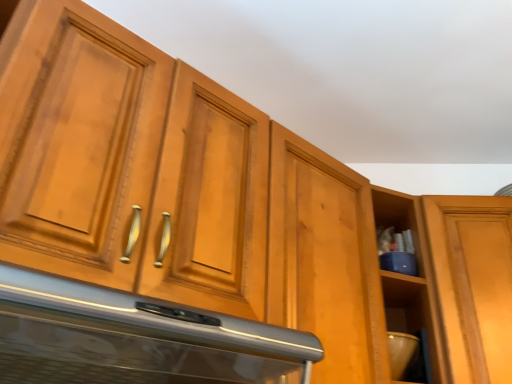
Image resolution: width=512 pixels, height=384 pixels. What do you see at coordinates (135, 338) in the screenshot?
I see `satin nickel range hood at center` at bounding box center [135, 338].

Image resolution: width=512 pixels, height=384 pixels. I want to click on satin nickel range hood at center, so tap(135, 338).

Find the location of a particular element. This screenshot has height=384, width=512. satin nickel range hood at center is located at coordinates (135, 338).